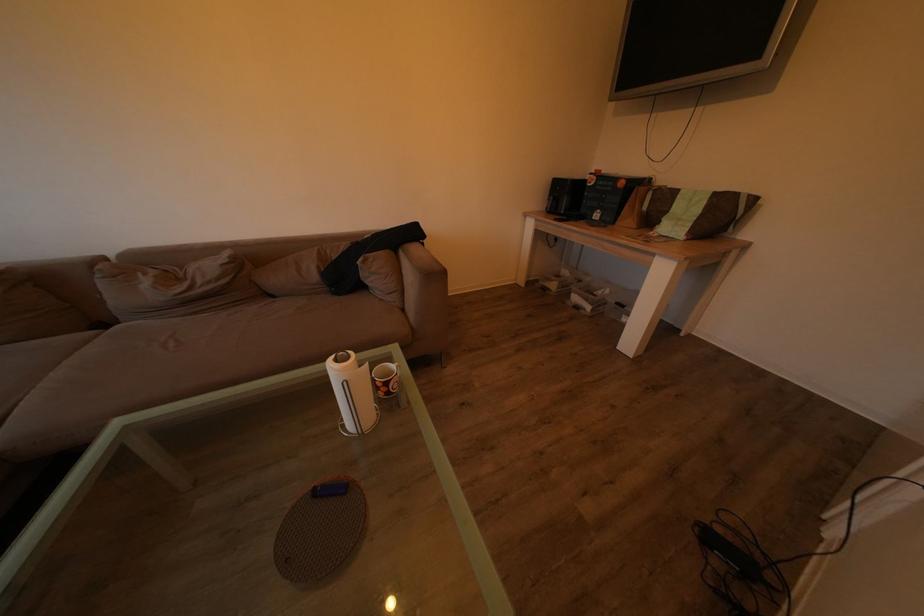
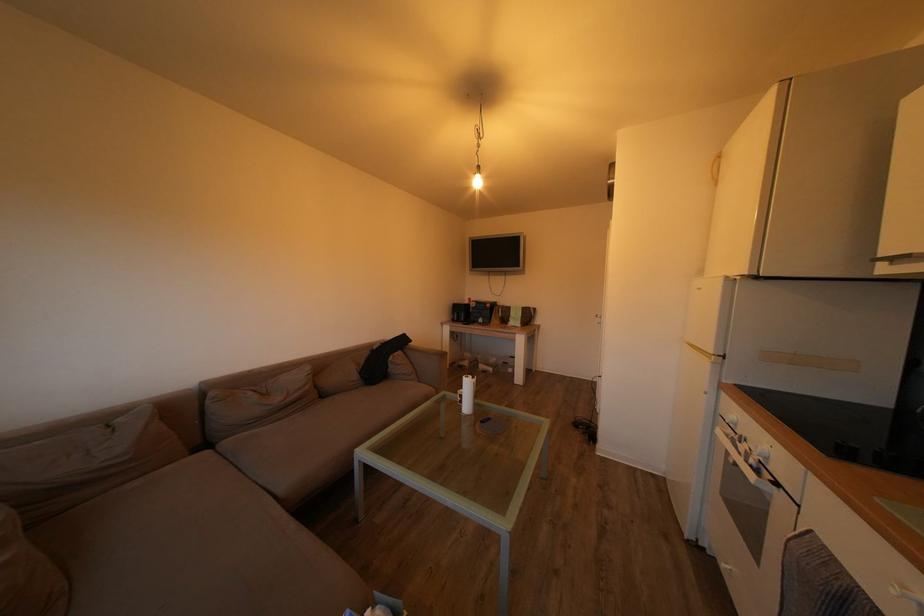
The point at (683, 199) is marked in the first image. Where is the corresponding point in the second image?

(517, 314)